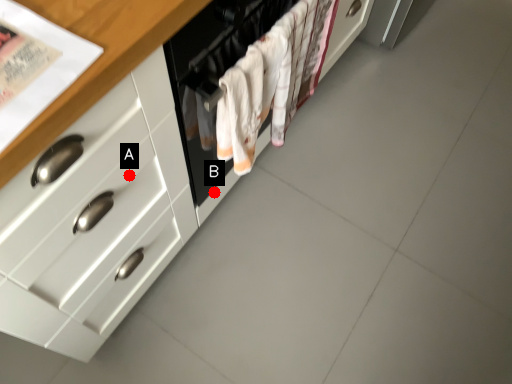
Question: Two points are circled on the image, labeled by A and B beside each circle. Which point is closer to the camera?

Choices:
 (A) A is closer
 (B) B is closer

Answer: (A)